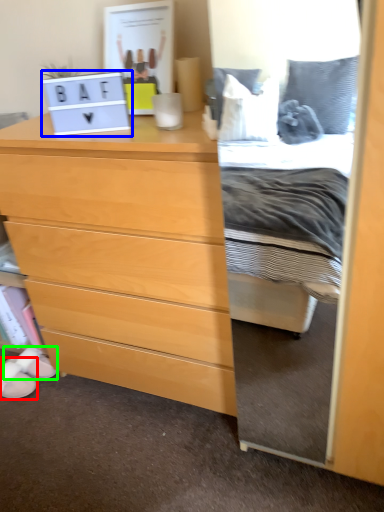
Question: Based on their relative distances, which object is nearer to shoe (highlighted by a red box)? Choose from laptop (highlighted by a blue box) and shoe (highlighted by a green box).

Choices:
 (A) laptop
 (B) shoe

Answer: (B)